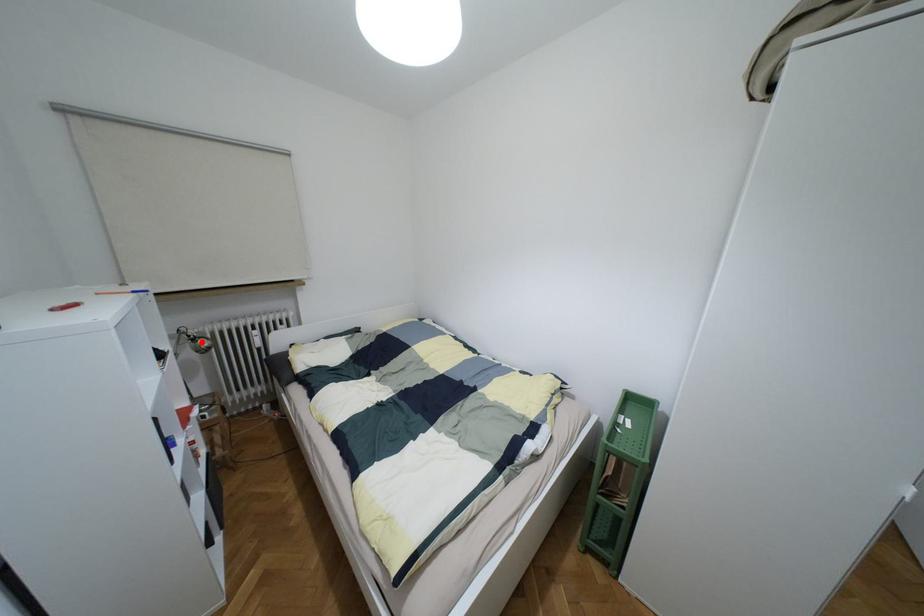
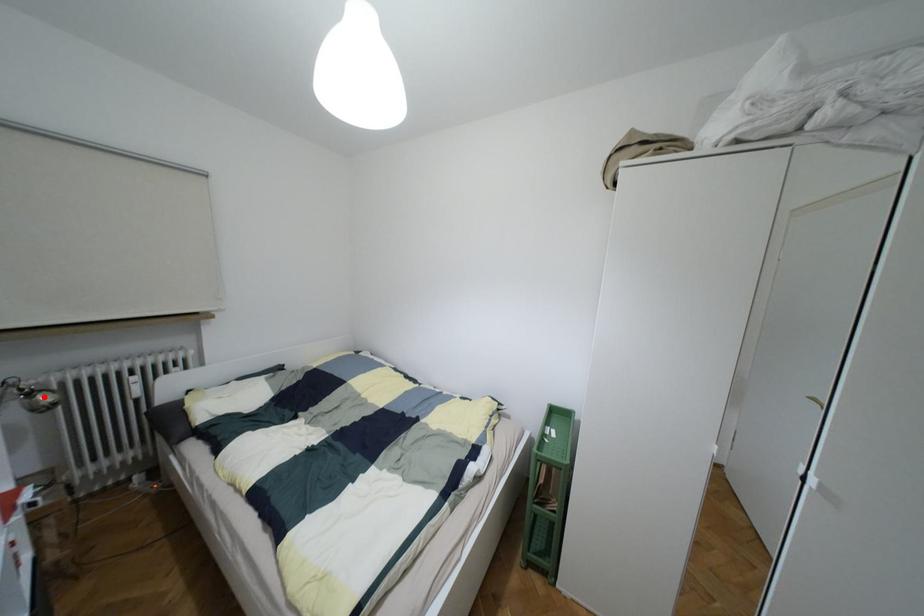
I am providing you with two images of the same scene from different viewpoints. A red point is marked on the first image and another point is marked on the second image. Does the point marked in image1 correspond to the same location as the one in image2?

Yes